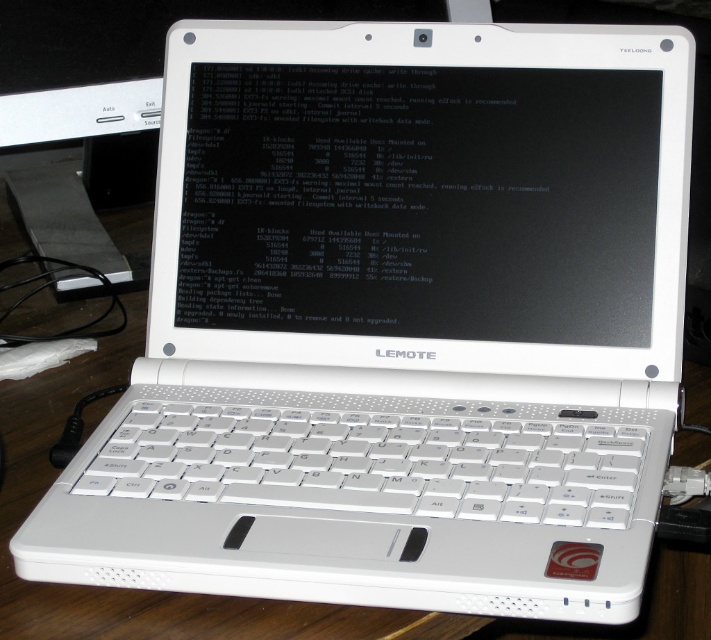
Question: Which point is closer to the camera?

Choices:
 (A) (550, 496)
 (B) (32, 211)

Answer: (A)

Question: Is white plastic keyboard at center thinner than white glossy computer monitor at center?

Choices:
 (A) yes
 (B) no

Answer: (A)

Question: Does white plastic keyboard at center have a lesser width compared to white glossy computer monitor at center?

Choices:
 (A) no
 (B) yes

Answer: (B)

Question: Can you confirm if white plastic keyboard at center is positioned below white glossy computer monitor at center?

Choices:
 (A) no
 (B) yes

Answer: (B)